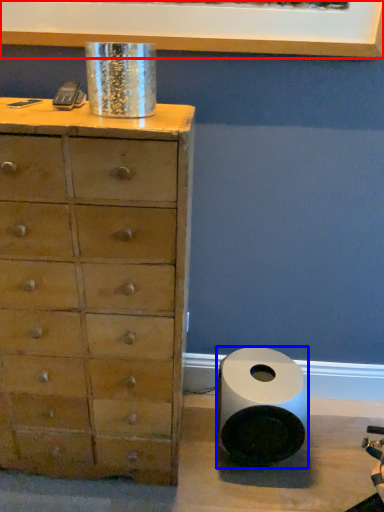
Question: Which object is closer to the camera taking this photo, picture frame (highlighted by a red box) or speaker (highlighted by a blue box)?

Choices:
 (A) picture frame
 (B) speaker

Answer: (A)